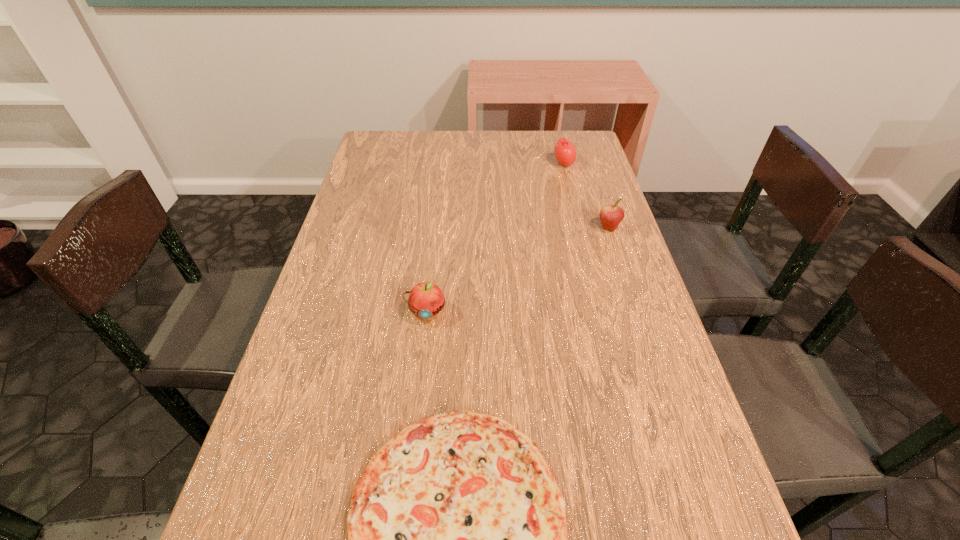
I want to click on empty space that is in between the third farthest object and the rightmost object, so click(517, 270).

The height and width of the screenshot is (540, 960). Identify the location of free space between the nearest apple and the second apple from left to right. (495, 238).

Image resolution: width=960 pixels, height=540 pixels. I want to click on unoccupied area between the nearest apple and the farthest apple, so click(495, 238).

The width and height of the screenshot is (960, 540). Find the location of `vacant space in between the third object from left to right and the third nearest object`. vacant space in between the third object from left to right and the third nearest object is located at coordinates (587, 195).

The width and height of the screenshot is (960, 540). Find the location of `the second closest object to the farthest apple`. the second closest object to the farthest apple is located at coordinates (426, 299).

Select which object appears as the third closest to the leftmost apple. Please provide its 2D coordinates. Your answer should be formatted as a tuple, i.e. [(x, y)], where the tuple contains the x and y coordinates of a point satisfying the conditions above.

[(565, 152)]

This screenshot has width=960, height=540. In order to click on the second closest apple to the second nearest object in this screenshot , I will do `click(565, 152)`.

The image size is (960, 540). Identify the location of the second closest apple relative to the second object from right to left. (426, 299).